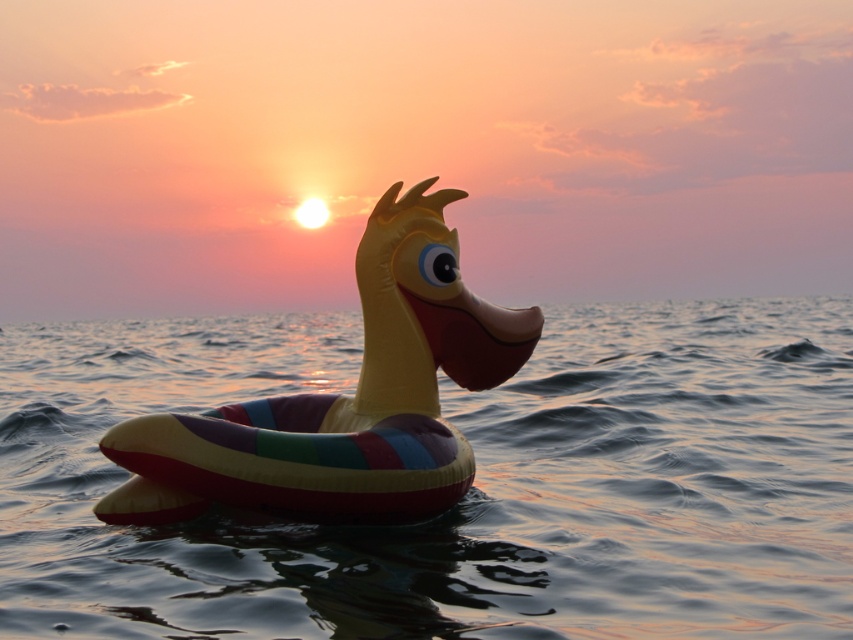
You are a photographer trying to capture the sunset reflection on the water. You see the translucent plastic water at center and the rubber duck at center. Which object is positioned higher in the scene?

The translucent plastic water at center is taller than the rubber duck at center, so it is positioned higher in the scene.

You are standing on the shore looking at the sunset scene. You see the translucent plastic water at center and the rubber duck at center. Which object is positioned to the right of the other?

The translucent plastic water at center is to the right of the rubber duck at center.

You are standing on the shore looking at the sunset scene. There is a point marked at coordinates (469, 492). What is located at this point?

At point (469, 492) lies translucent plastic water at center.